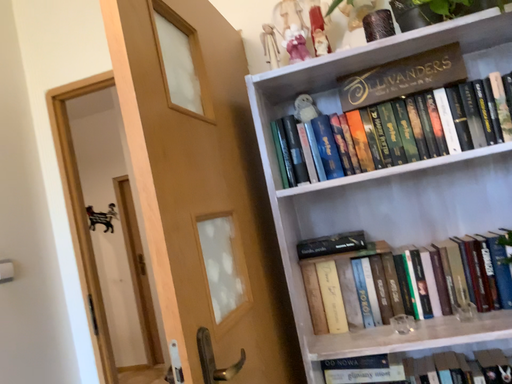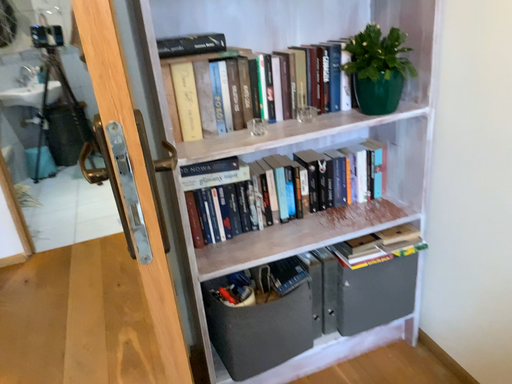
Question: How did the camera likely rotate when shooting the video?

Choices:
 (A) rotated upward
 (B) rotated downward

Answer: (B)